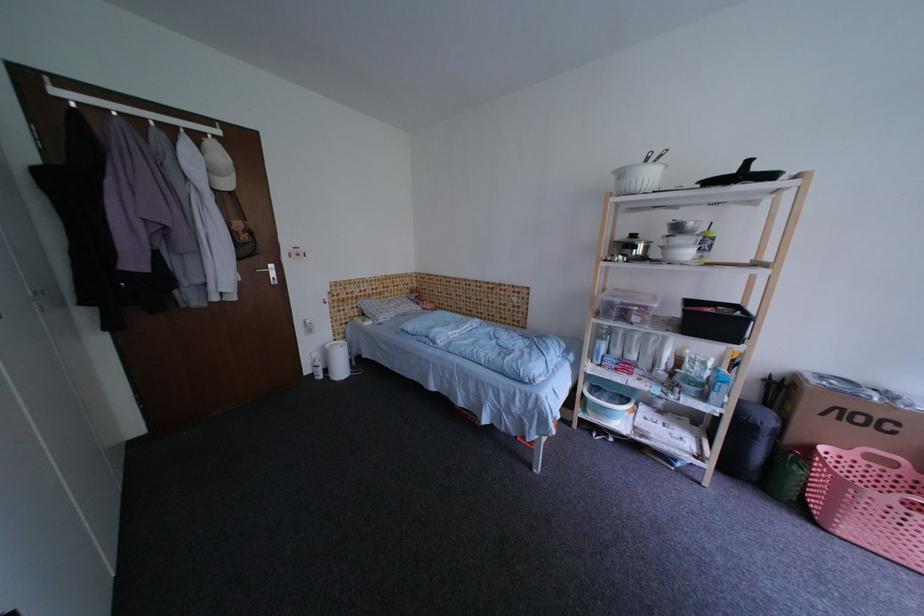
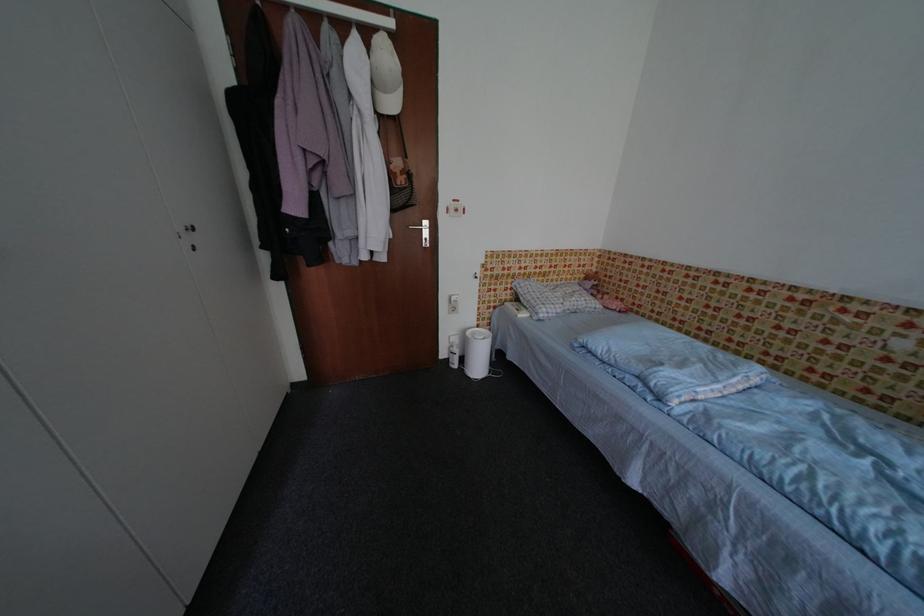
The point at [324,358] is marked in the first image. Where is the corresponding point in the second image?

(464, 342)